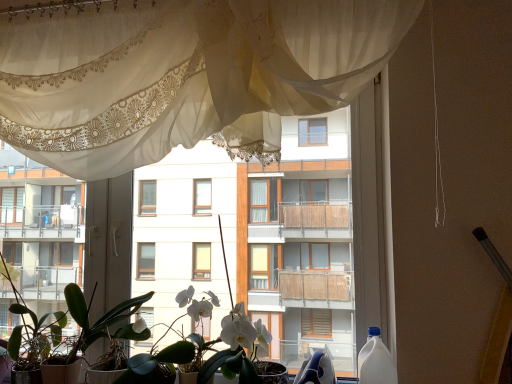
Question: Can you confirm if white glossy balcony at left is smaller than white matte orchid at center?

Choices:
 (A) yes
 (B) no

Answer: (B)

Question: Are white glossy balcony at left and white matte orchid at center making contact?

Choices:
 (A) no
 (B) yes

Answer: (A)

Question: Would you say white glossy balcony at left is outside white matte orchid at center?

Choices:
 (A) no
 (B) yes

Answer: (B)

Question: Considering the relative sizes of white glossy balcony at left and white matte orchid at center in the image provided, is white glossy balcony at left bigger than white matte orchid at center?

Choices:
 (A) yes
 (B) no

Answer: (A)

Question: Is white glossy balcony at left taller than white matte orchid at center?

Choices:
 (A) no
 (B) yes

Answer: (B)

Question: Considering the positions of sheer white curtain at upper center and white glossy balcony at left in the image, is sheer white curtain at upper center wider or thinner than white glossy balcony at left?

Choices:
 (A) wide
 (B) thin

Answer: (B)

Question: From the image's perspective, is sheer white curtain at upper center located above or below white glossy balcony at left?

Choices:
 (A) above
 (B) below

Answer: (A)

Question: Is sheer white curtain at upper center taller or shorter than white glossy balcony at left?

Choices:
 (A) tall
 (B) short

Answer: (B)

Question: Relative to white glossy balcony at left, is sheer white curtain at upper center in front or behind?

Choices:
 (A) front
 (B) behind

Answer: (A)

Question: Would you say green matte plant at lower left is inside or outside sheer white curtain at upper center?

Choices:
 (A) outside
 (B) inside

Answer: (A)

Question: From the image's perspective, is green matte plant at lower left located above or below sheer white curtain at upper center?

Choices:
 (A) below
 (B) above

Answer: (A)

Question: Is green matte plant at lower left taller or shorter than sheer white curtain at upper center?

Choices:
 (A) short
 (B) tall

Answer: (A)

Question: In the image, is green matte plant at lower left positioned in front of or behind sheer white curtain at upper center?

Choices:
 (A) front
 (B) behind

Answer: (B)

Question: Is sheer white curtain at upper center bigger or smaller than white matte orchid at center?

Choices:
 (A) big
 (B) small

Answer: (A)

Question: Is point (110, 155) closer or farther from the camera than point (200, 365)?

Choices:
 (A) closer
 (B) farther

Answer: (A)